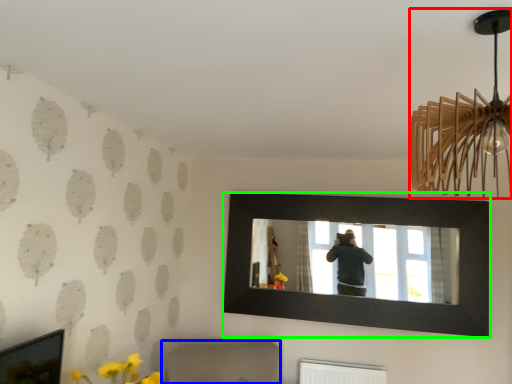
Question: Which object is positioned closest to lamp (highlighted by a red box)? Select from furniture (highlighted by a blue box) and picture frame (highlighted by a green box).

Choices:
 (A) furniture
 (B) picture frame

Answer: (B)